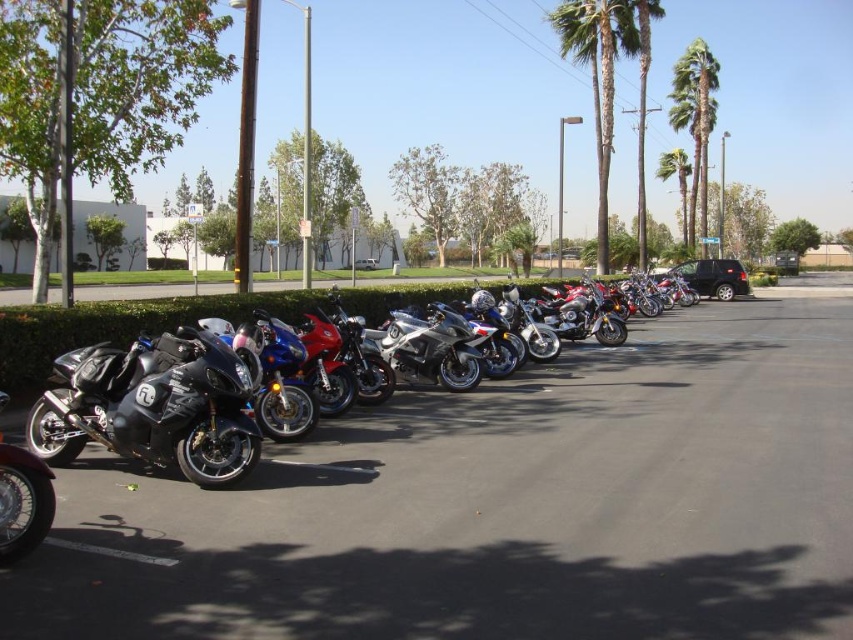
You are a drone operator planning to fly a drone between the green leafy palm tree at upper center and the green leafy palm trees at upper right. Given that your drone has a maximum flight distance of 12 meters, will it be able to travel between them without needing to recharge?

The distance between the green leafy palm tree at upper center and the green leafy palm trees at upper right is 13.08 meters. Since the drone can only fly 12 meters before needing to recharge, it will not be able to travel between them without recharging.

You are standing in the parking lot and want to take a photo of the green leafy palm tree at upper center. Which direction should you face to capture it in your camera view?

The green leafy palm tree at upper center is located at point (598, 76), so you should face towards the upper center direction to capture it in your camera view.